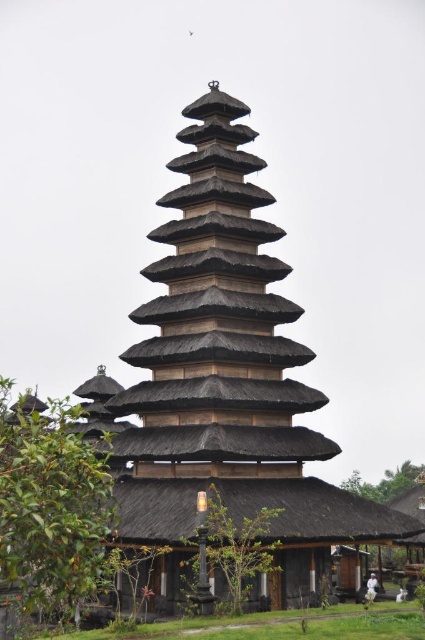
Question: Which point is farther to the camera?

Choices:
 (A) green leafy tree at lower left
 (B) green leafy tree at lower right

Answer: (B)

Question: Which object is positioned closest to the green leafy tree at lower left?

Choices:
 (A) green leafy tree at lower right
 (B) green leafy tree at center

Answer: (B)

Question: Is green leafy tree at lower left bigger than green leafy tree at center?

Choices:
 (A) no
 (B) yes

Answer: (B)

Question: Does green leafy tree at lower left appear over green leafy tree at center?

Choices:
 (A) yes
 (B) no

Answer: (A)

Question: Which point appears farthest from the camera in this image?

Choices:
 (A) (353, 484)
 (B) (209, 564)
 (C) (3, 531)

Answer: (A)

Question: Does green leafy tree at center have a greater width compared to green leafy tree at lower right?

Choices:
 (A) yes
 (B) no

Answer: (B)